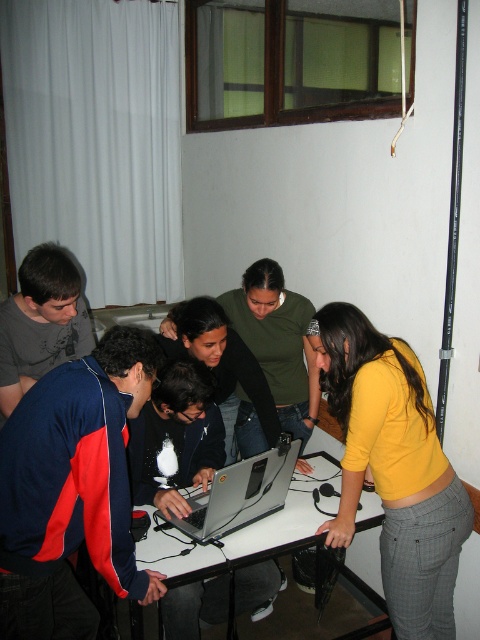
Question: In this image, where is yellow matte shirt at center located relative to white glossy table at center?

Choices:
 (A) left
 (B) right

Answer: (B)

Question: Does white glossy table at center appear under silver metallic laptop at center?

Choices:
 (A) yes
 (B) no

Answer: (A)

Question: Which point is closer to the camera?

Choices:
 (A) white glossy table at center
 (B) yellow matte shirt at center

Answer: (B)

Question: Does white glossy table at center appear on the left side of silver metallic laptop at center?

Choices:
 (A) yes
 (B) no

Answer: (B)

Question: Which object is the closest to the white glossy table at center?

Choices:
 (A) silver metallic laptop at center
 (B) yellow matte shirt at center

Answer: (A)

Question: Which object appears closest to the camera in this image?

Choices:
 (A) yellow matte shirt at center
 (B) silver metallic laptop at center

Answer: (A)